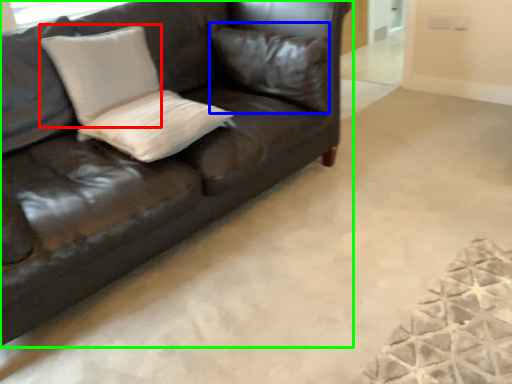
Question: Which object is the closest to the pillow (highlighted by a red box)? Choose among these: pillow (highlighted by a blue box) or studio couch (highlighted by a green box).

Choices:
 (A) pillow
 (B) studio couch

Answer: (B)